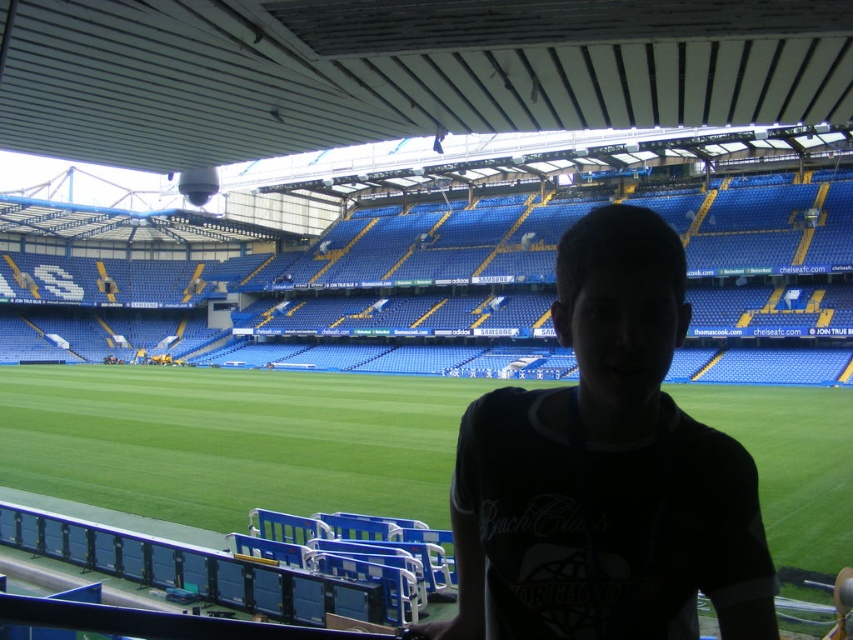
Question: Which object is closer to the camera taking this photo?

Choices:
 (A) green grass at center
 (B) black matte shirt at center

Answer: (B)

Question: Which of the following is the closest to the observer?

Choices:
 (A) black matte shirt at center
 (B) green grass at center

Answer: (A)

Question: Considering the relative positions of black matte shirt at center and green grass at center in the image provided, where is black matte shirt at center located with respect to green grass at center?

Choices:
 (A) above
 (B) below

Answer: (A)

Question: Where is black matte shirt at center located in relation to green grass at center in the image?

Choices:
 (A) left
 (B) right

Answer: (B)

Question: Can you confirm if black matte shirt at center is wider than green grass at center?

Choices:
 (A) yes
 (B) no

Answer: (B)